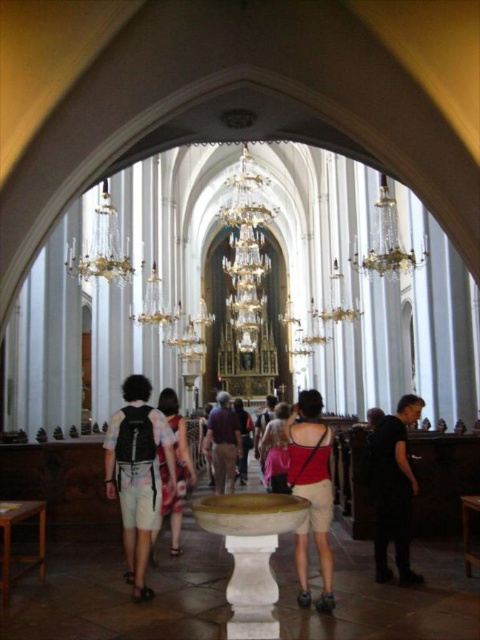
You are standing in the cathedral and want to locate the black matte shirt at lower right. According to the coordinates provided, where should you look?

You should look at point 0.766 on the x axis and 0.821 on the y axis to find the black matte shirt at lower right.